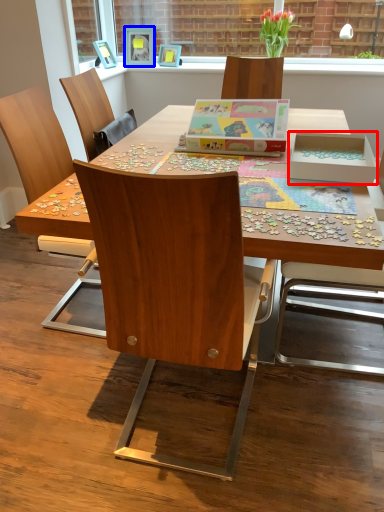
Question: Which of the following is the closest to the observer, box (highlighted by a red box) or picture frame (highlighted by a blue box)?

Choices:
 (A) box
 (B) picture frame

Answer: (A)